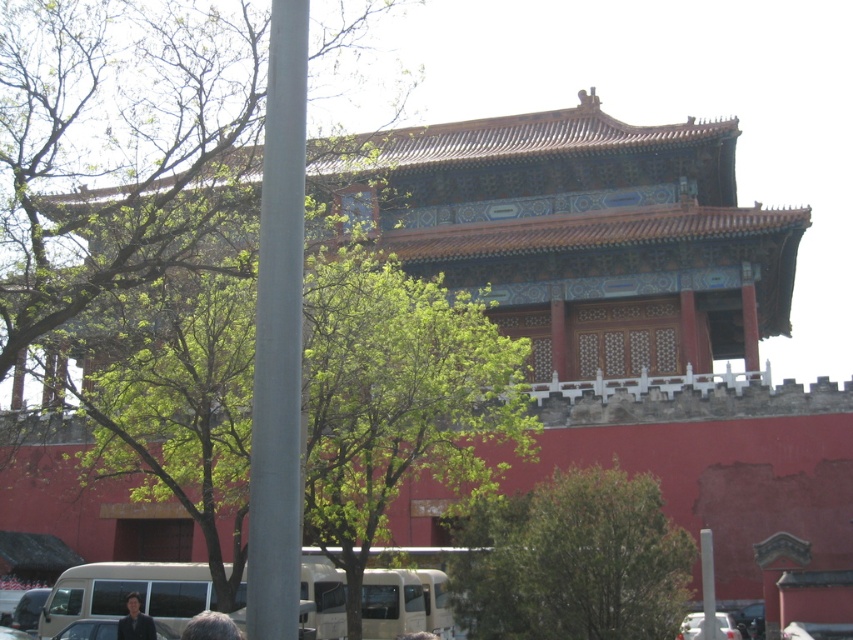
You are a tourist standing at the entrance of the Forbidden City. You see a white glossy pole at lower right and a dark brown hair at lower center. Which object is closer to the ground?

The white glossy pole at lower right is located below dark brown hair at lower center, so it is closer to the ground.

You are a tourist standing in front of the traditional Chinese structure and see the white glossy pole at lower right and the dark brown hair at lower center. Which object is located to the right of the other?

The white glossy pole at lower right is positioned on the right side of dark brown hair at lower center.

You are a photographer planning to take a picture of the traditional Chinese architectural structure in the background. You want to ensure that both the green leafy tree at center and the dark brown hair at lower center are visible in the frame. Based on their heights, which object will appear taller in the final photo?

The green leafy tree at center will appear taller in the photo because it has a greater height compared to the dark brown hair at lower center.